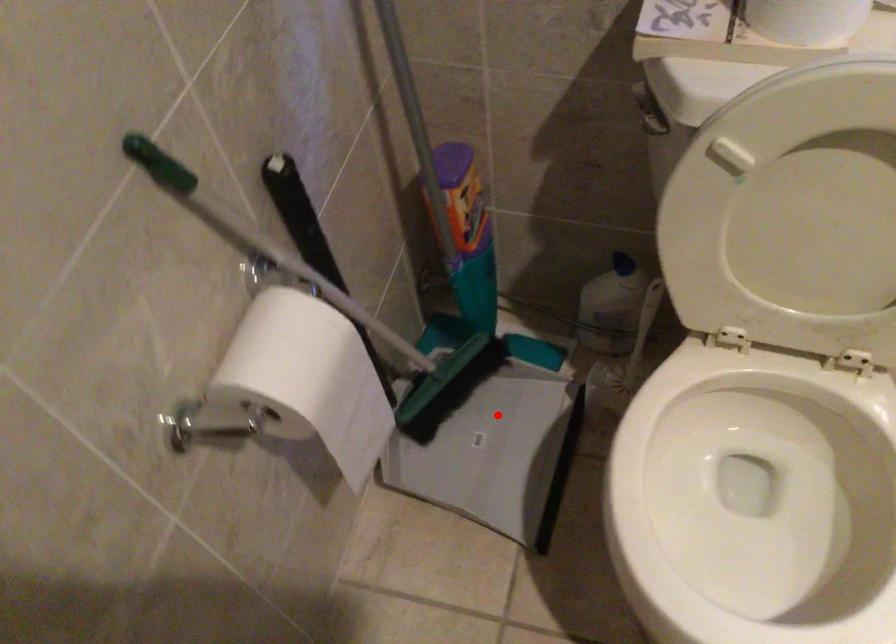
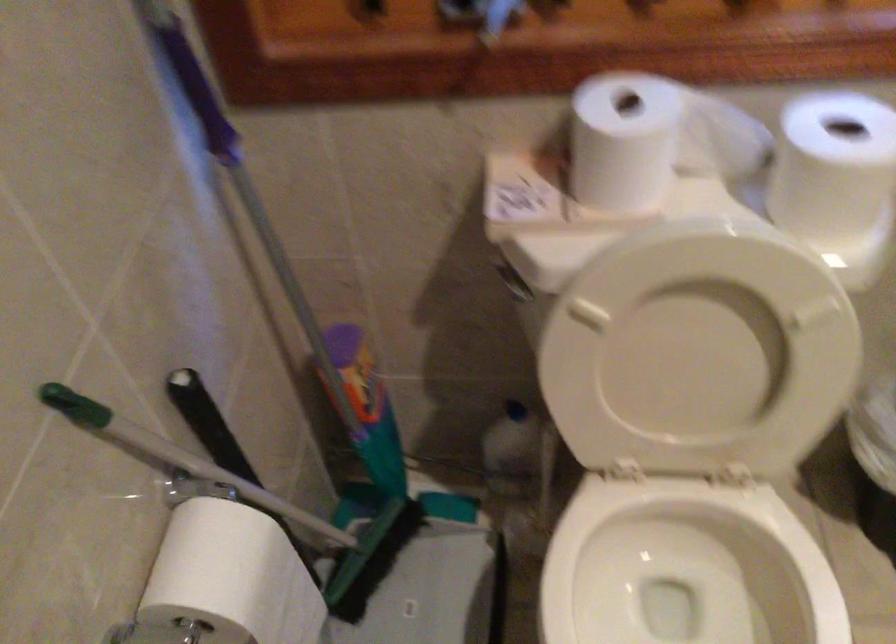
The point at the highlighted location is marked in the first image. Where is the corresponding point in the second image?

(424, 576)